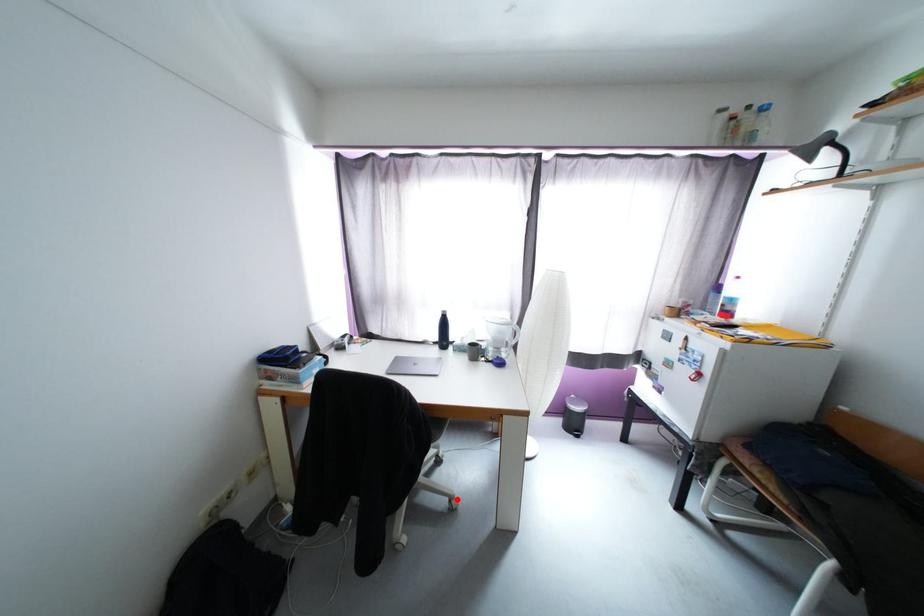
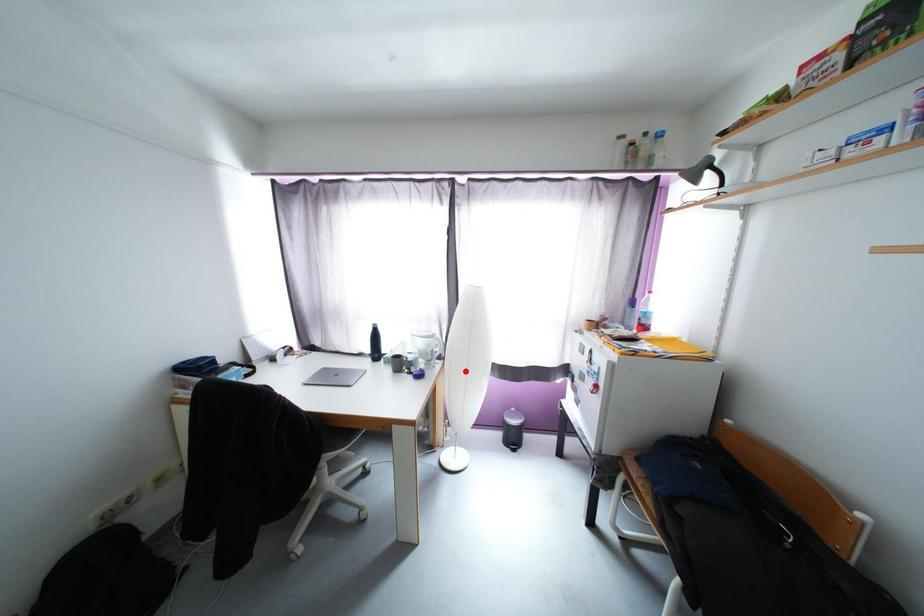
I am providing you with two images of the same scene from different viewpoints. A red point is marked on the first image and another point is marked on the second image. Do the highlighted points in image1 and image2 indicate the same real-world spot?

No